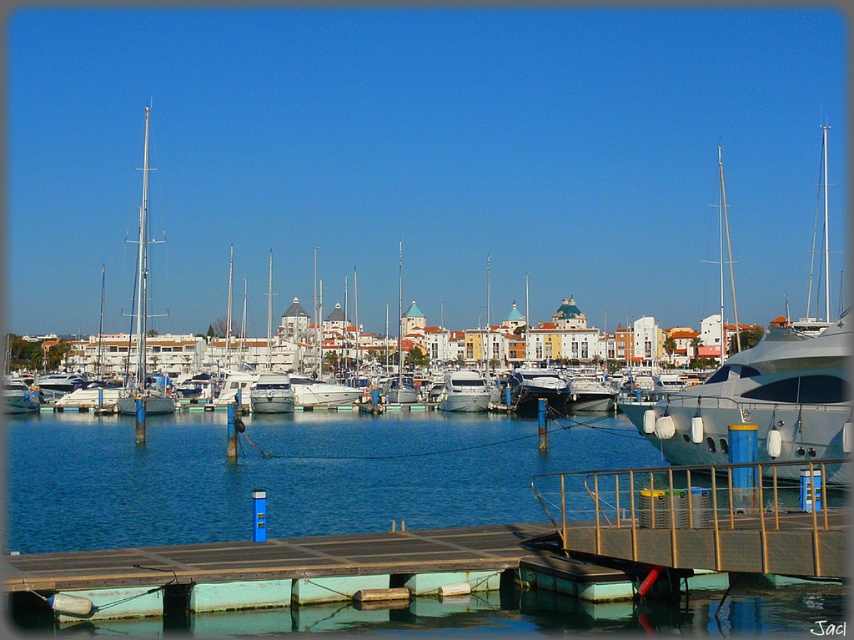
Question: Does blue water at center lie behind white glossy yacht at center?

Choices:
 (A) yes
 (B) no

Answer: (B)

Question: Which point is closer to the camera?

Choices:
 (A) metallic gray dock at center
 (B) silver metallic mast at left
 (C) white glossy yacht at right

Answer: (A)

Question: Can you confirm if metallic gray dock at center is positioned to the left of silver metallic mast at left?

Choices:
 (A) yes
 (B) no

Answer: (B)

Question: Which of these objects is positioned closest to the blue water at center?

Choices:
 (A) white glossy yacht at right
 (B) metallic gray dock at center
 (C) white glossy yacht at center
 (D) silver metallic mast at left

Answer: (B)

Question: Which point is closer to the camera taking this photo?

Choices:
 (A) (688, 490)
 (B) (145, 134)

Answer: (A)

Question: Can you confirm if metallic gray dock at center is positioned above white glossy yacht at center?

Choices:
 (A) no
 (B) yes

Answer: (A)